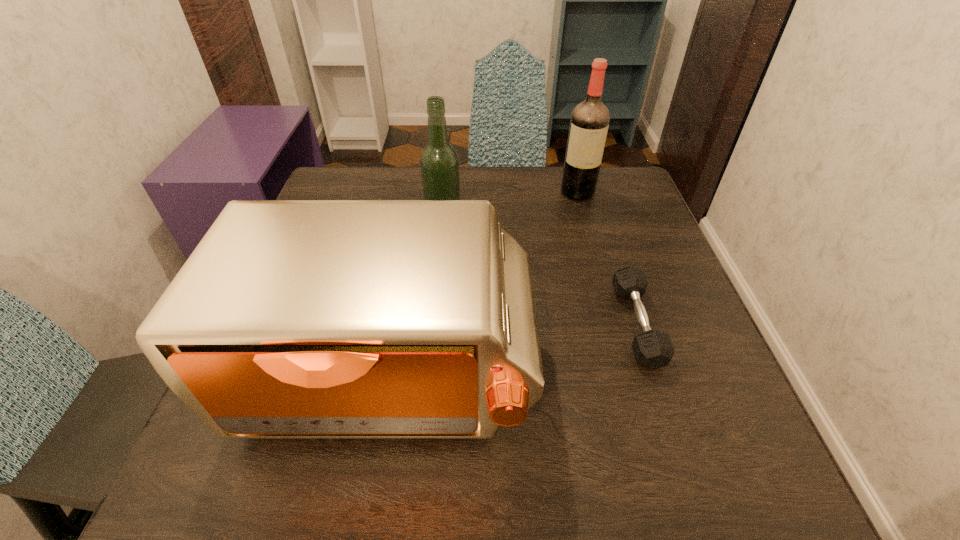
Where is `vacant area in the image that satisfies the following two spatial constraints: 1. on the front-facing side of the dumbbell; 2. on the right side of the farthest object`? The width and height of the screenshot is (960, 540). vacant area in the image that satisfies the following two spatial constraints: 1. on the front-facing side of the dumbbell; 2. on the right side of the farthest object is located at coordinates (615, 324).